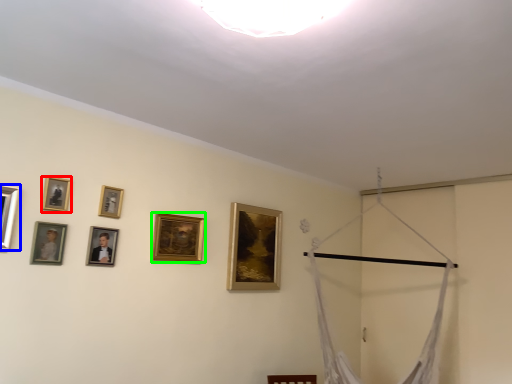
Question: Estimate the real-world distances between objects in this image. Which object is farther from picture frame (highlighted by a red box), picture frame (highlighted by a blue box) or picture frame (highlighted by a green box)?

Choices:
 (A) picture frame
 (B) picture frame

Answer: (B)